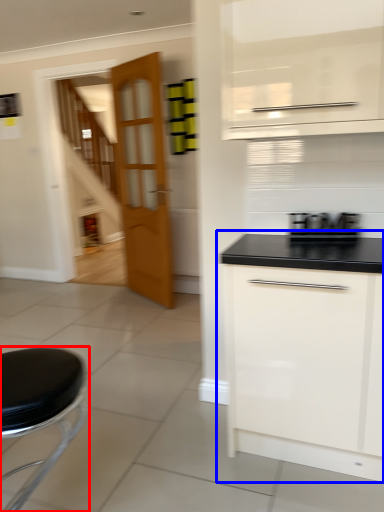
Question: Which object appears closest to the camera in this image, furniture (highlighted by a red box) or cabinetry (highlighted by a blue box)?

Choices:
 (A) furniture
 (B) cabinetry

Answer: (A)